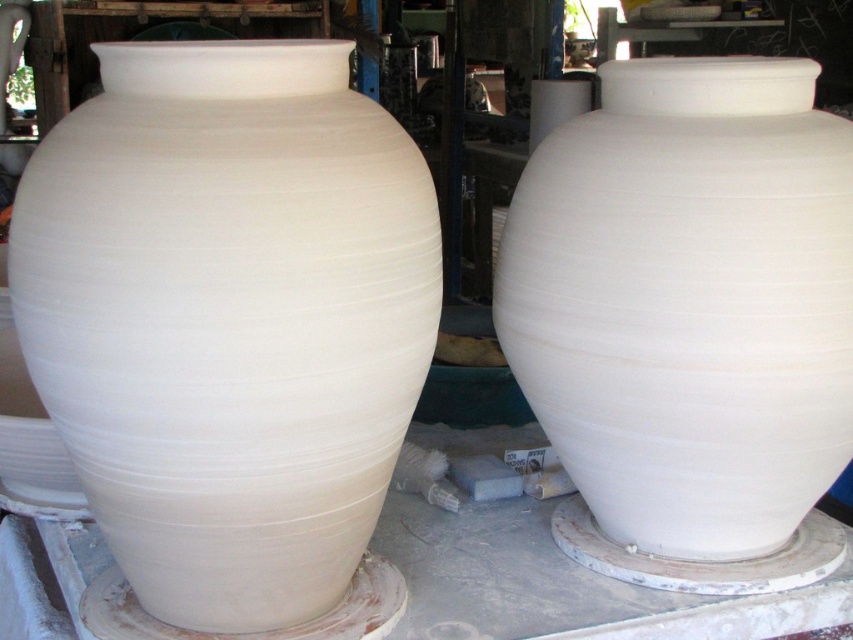
You are a photographer standing at the camera position. You want to capture a closeup shot of the white clay vase at center. Considering your current distance, is the vase within a 1 meter range from the camera?

The white clay vase at center is 80.95 centimeters away from camera, which is within 1 meter, so yes, it is within range for a closeup shot.

In the scene shown: You are standing in a pottery studio and see the white clay vase at center. If you want to place a small sticker exactly at its center point, what are the coordinates where you should place it?

The coordinates for the center point of the white clay vase at center are at point (228, 317).